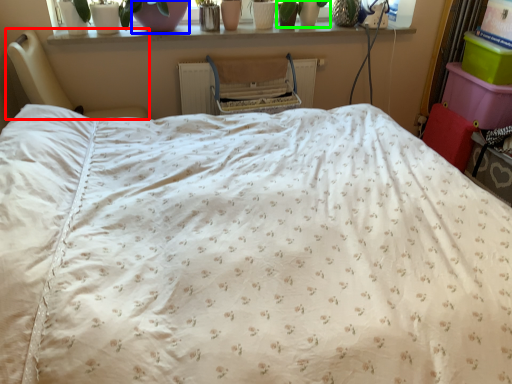
Question: Considering the real-world distances, which object is farthest from furniture (highlighted by a red box)? glass vase (highlighted by a blue box) or plant (highlighted by a green box)?

Choices:
 (A) glass vase
 (B) plant

Answer: (B)